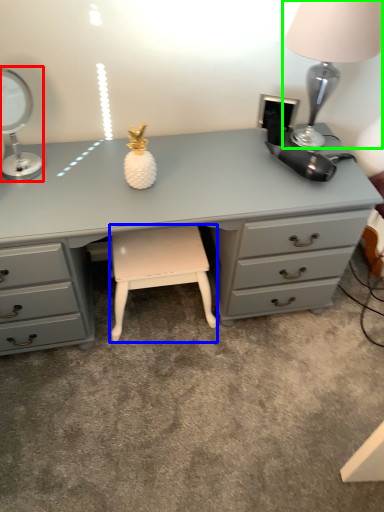
Question: Which object is positioned farthest from table lamp (highlighted by a red box)? Select from stool (highlighted by a blue box) and table lamp (highlighted by a green box).

Choices:
 (A) stool
 (B) table lamp

Answer: (B)